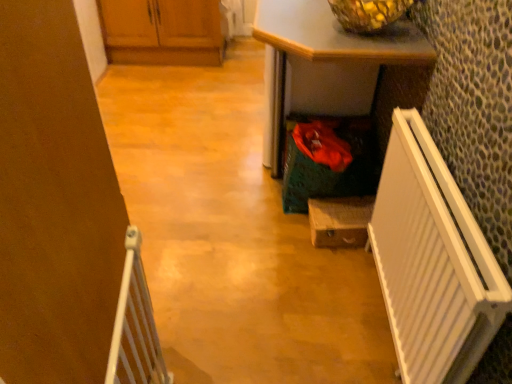
The height and width of the screenshot is (384, 512). In order to click on free space between wooden cabinets at upper left, which is the second cabinetry from front to back, and green textured desk at center in this screenshot , I will do `click(195, 105)`.